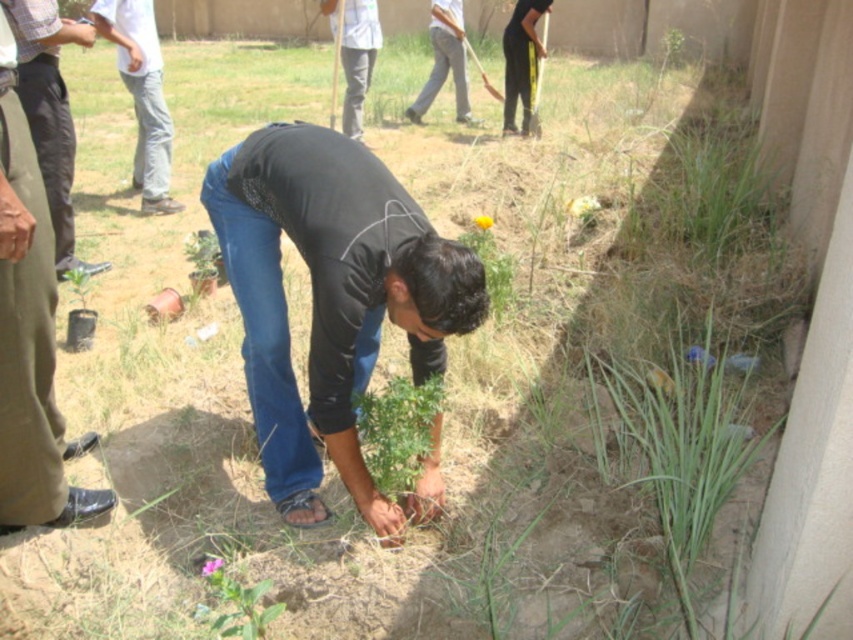
Question: Which point is closer to the camera?

Choices:
 (A) (506, 49)
 (B) (714, 356)
 (C) (210, 556)
 (D) (25, 422)

Answer: (D)

Question: Does brown cotton pants at lower left appear on the right side of blue matte flower at lower right?

Choices:
 (A) yes
 (B) no

Answer: (B)

Question: Estimate the real-world distances between objects in this image. Which object is closer to the light brown fabric pants at upper center?

Choices:
 (A) yellow matte flower at center-right
 (B) pink matte flower at lower center

Answer: (A)

Question: Is light gray jeans at upper left positioned behind blue matte flower at lower right?

Choices:
 (A) yes
 (B) no

Answer: (A)

Question: Is yellow matte flower at center-right above pink matte flower at lower center?

Choices:
 (A) yes
 (B) no

Answer: (A)

Question: Which object is farther from the camera taking this photo?

Choices:
 (A) brown leather shoes at lower left
 (B) black fabric pants at center
 (C) pink matte flower at lower center
 (D) light gray jeans at upper left

Answer: (B)